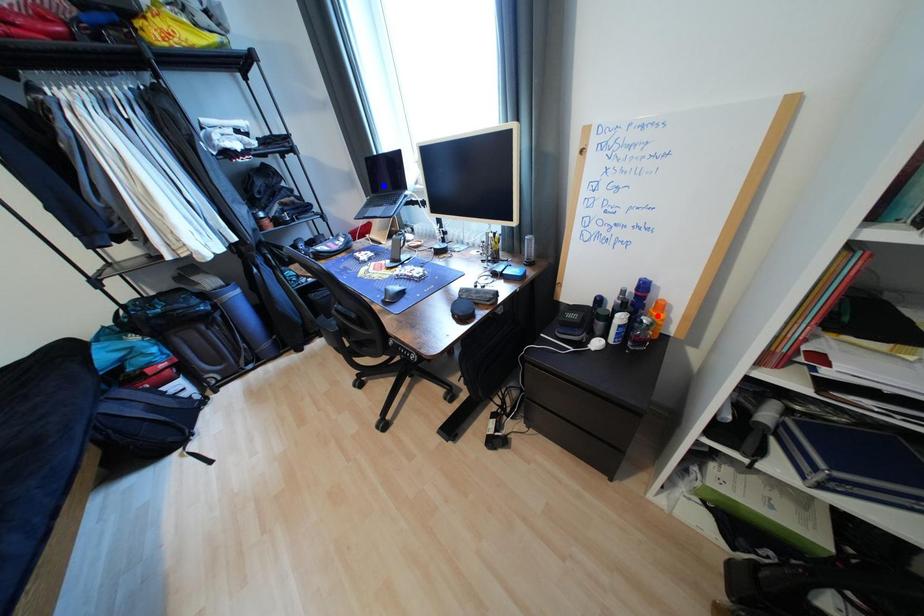
Question: Which of the two points in the image is closer to the camera?

Choices:
 (A) Blue point is closer.
 (B) Red point is closer.

Answer: (B)